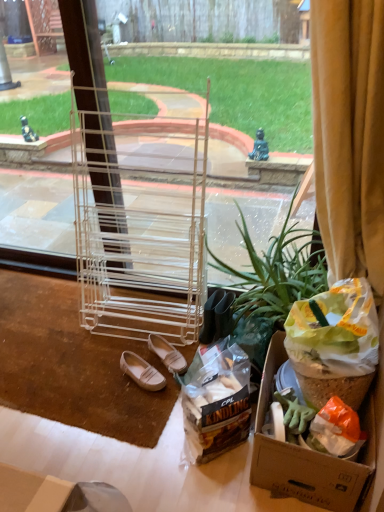
Where is `free space above translucent plastic bag of kindling at lower center (from a real-world perspective)`? free space above translucent plastic bag of kindling at lower center (from a real-world perspective) is located at coordinates (210, 387).